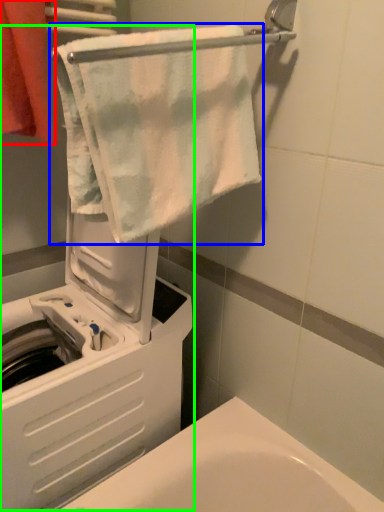
Question: Which is farther away from towel (highlighted by a red box)? towel (highlighted by a blue box) or machine (highlighted by a green box)?

Choices:
 (A) towel
 (B) machine

Answer: (B)